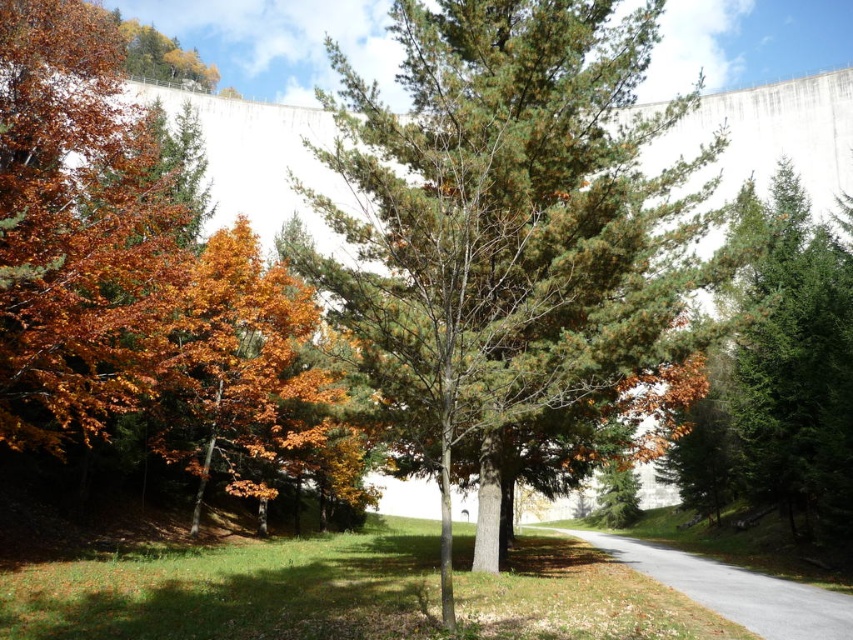
You are a hiker trying to decide whether to walk along the gray asphalt road at center or stay near the orange matte tree at left for a better view of the autumn leaves. Which location offers a wider path for walking?

The gray asphalt road at center is larger than the orange matte tree at left, so walking along the gray asphalt road at center provides a wider path for the hiker.

You are standing on the paved road in the image and want to walk towards the point marked as point (222, 448) and point (813, 637). Which point will you reach first?

You will reach point (222, 448) first because it is closer to you than point (813, 637), which is further away.